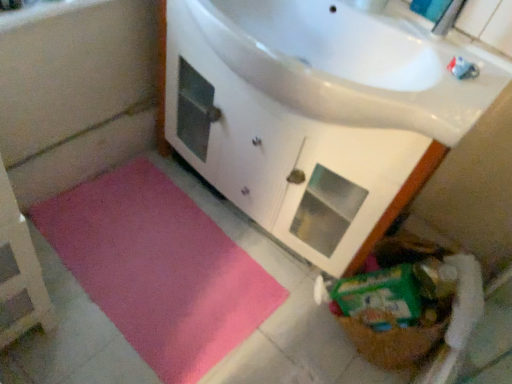
Question: Is pink fabric bath mat at lower left aimed at white glossy cabinet at upper center?

Choices:
 (A) yes
 (B) no

Answer: (B)

Question: Is the depth of pink fabric bath mat at lower left less than that of white glossy cabinet at upper center?

Choices:
 (A) yes
 (B) no

Answer: (B)

Question: Is pink fabric bath mat at lower left surrounding white glossy cabinet at upper center?

Choices:
 (A) yes
 (B) no

Answer: (B)

Question: Does pink fabric bath mat at lower left have a lesser height compared to white glossy cabinet at upper center?

Choices:
 (A) yes
 (B) no

Answer: (A)

Question: Is pink fabric bath mat at lower left not close to white glossy cabinet at upper center?

Choices:
 (A) yes
 (B) no

Answer: (B)

Question: Considering the positions of pink plush bath mat at lower left and brown woven basket at lower right in the image, is pink plush bath mat at lower left bigger or smaller than brown woven basket at lower right?

Choices:
 (A) small
 (B) big

Answer: (A)

Question: Is pink plush bath mat at lower left situated inside brown woven basket at lower right or outside?

Choices:
 (A) inside
 (B) outside

Answer: (B)

Question: Based on their positions, is pink plush bath mat at lower left located to the left or right of brown woven basket at lower right?

Choices:
 (A) left
 (B) right

Answer: (A)

Question: Considering the positions of pink plush bath mat at lower left and brown woven basket at lower right in the image, is pink plush bath mat at lower left taller or shorter than brown woven basket at lower right?

Choices:
 (A) tall
 (B) short

Answer: (B)

Question: Would you say pink plush bath mat at lower left is inside or outside white glossy faucet at upper center?

Choices:
 (A) outside
 (B) inside

Answer: (A)

Question: Is pink plush bath mat at lower left taller or shorter than white glossy faucet at upper center?

Choices:
 (A) tall
 (B) short

Answer: (B)

Question: From the image's perspective, is pink plush bath mat at lower left positioned above or below white glossy faucet at upper center?

Choices:
 (A) above
 (B) below

Answer: (B)

Question: In terms of width, does pink plush bath mat at lower left look wider or thinner when compared to white glossy faucet at upper center?

Choices:
 (A) wide
 (B) thin

Answer: (A)

Question: Considering the positions of white glossy faucet at upper center and pink fabric bath mat at lower left in the image, is white glossy faucet at upper center taller or shorter than pink fabric bath mat at lower left?

Choices:
 (A) tall
 (B) short

Answer: (B)

Question: Considering the positions of white glossy faucet at upper center and pink fabric bath mat at lower left in the image, is white glossy faucet at upper center bigger or smaller than pink fabric bath mat at lower left?

Choices:
 (A) big
 (B) small

Answer: (B)